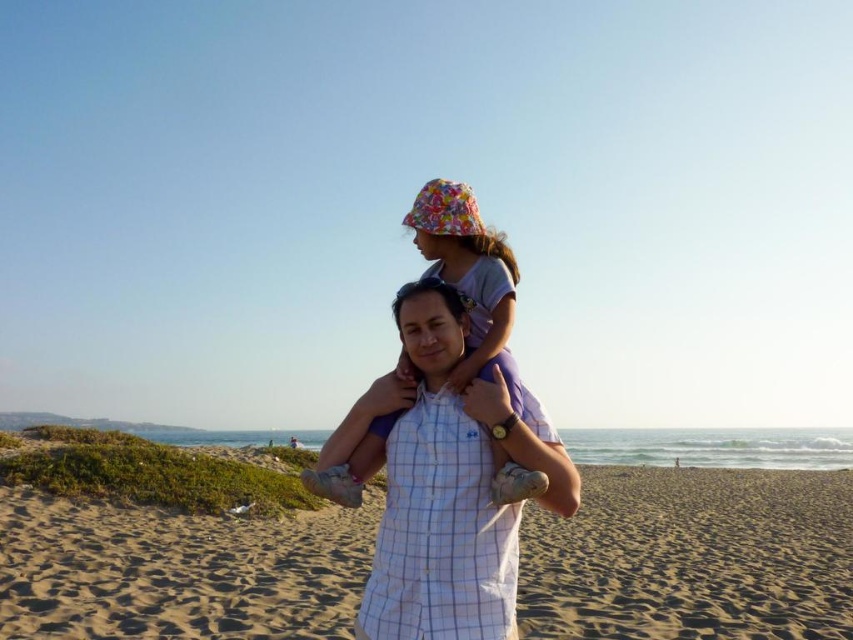
You are standing on the beach and want to place a small flag exactly at the center of the sandy yellow sand at center. According to the coordinates provided, where should you place the flag?

The flag should be placed at the coordinates point (693, 556) as that is the 2D location of the sandy yellow sand at center.

You are standing on the beach looking at the scene. There are two points marked on the sand, one at point coordinates point (561, 456) and another at point coordinates point (467, 205). Which point is closer to you?

Point (561, 456) is closer to the camera than point (467, 205), so the point at coordinates point (561, 456) is closer to you.